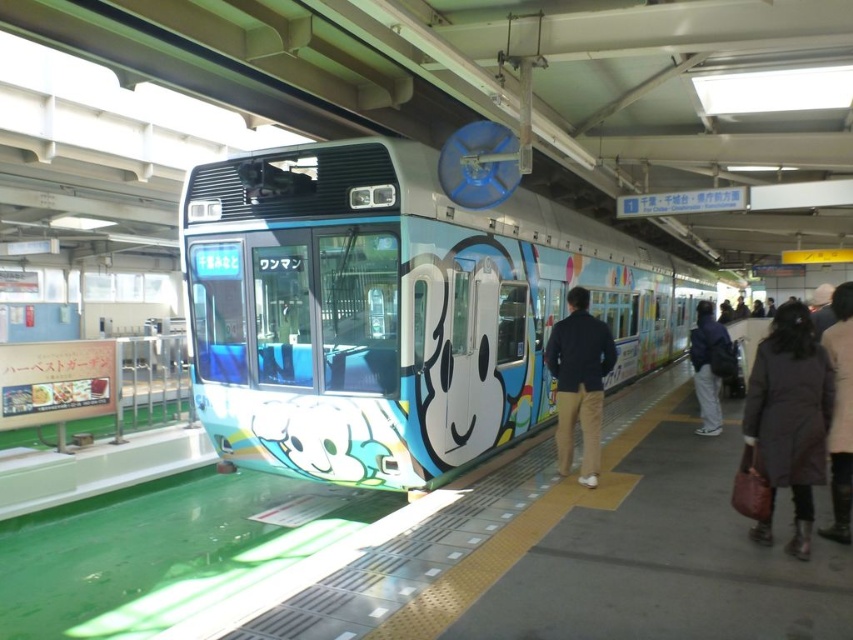
Does point (592, 452) lie in front of point (844, 339)?

No, it is behind (844, 339).

Is point (589, 339) positioned after point (844, 518)?

That is True.

Who is more distant from viewer, (560,387) or (840,522)?

The point (560,387) is behind.

At what (x,y) coordinates should I click in order to perform the action: click on dark blue jacket at center. Please return your answer as a coordinate pair (x, y). The image size is (853, 640). Looking at the image, I should click on [579, 381].

Can you confirm if brown leather bag at lower right is positioned to the left of light gray pants at right?

Indeed, brown leather bag at lower right is positioned on the left side of light gray pants at right.

Is point (779, 332) farther from camera compared to point (699, 339)?

No, it is in front of (699, 339).

Find the location of a particular element. brown leather bag at lower right is located at coordinates (788, 419).

Is matte blue train at center taller than brown leather bag at lower right?

Yes, matte blue train at center is taller than brown leather bag at lower right.

Measure the distance between point (537, 356) and camera.

Point (537, 356) is 8.72 meters from camera.

Locate an element on the screen. matte blue train at center is located at coordinates (393, 310).